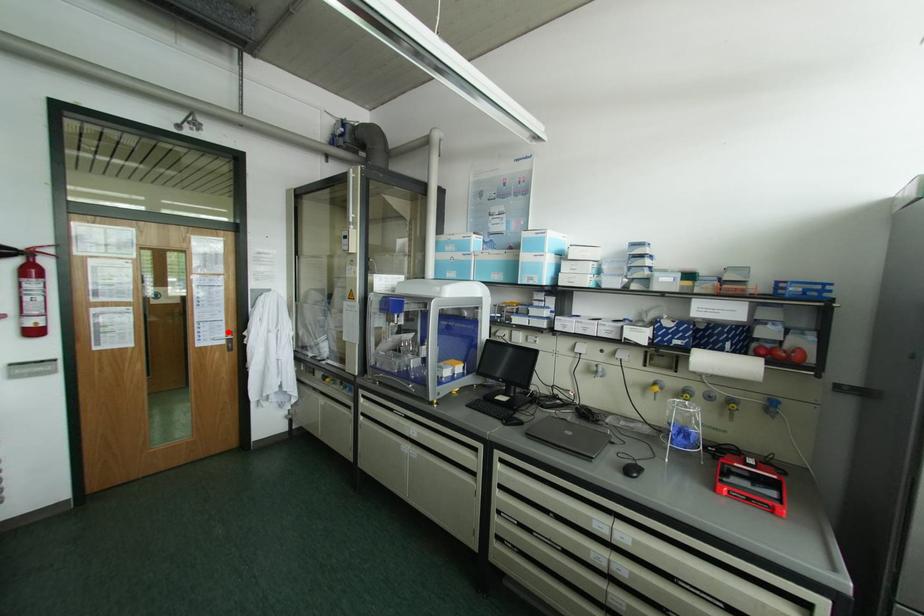
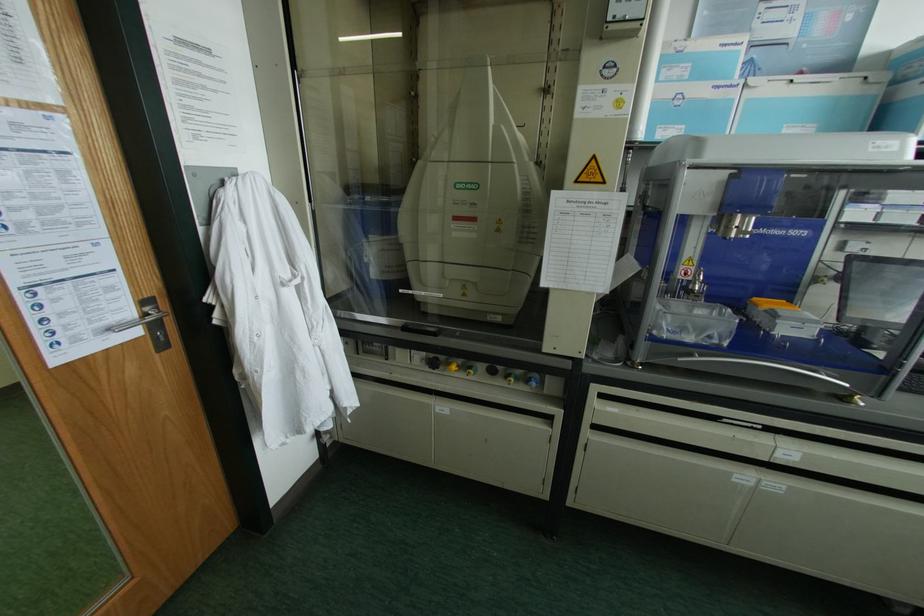
Find the pixel in the second image that matches the highlighted location in the first image.

(142, 302)